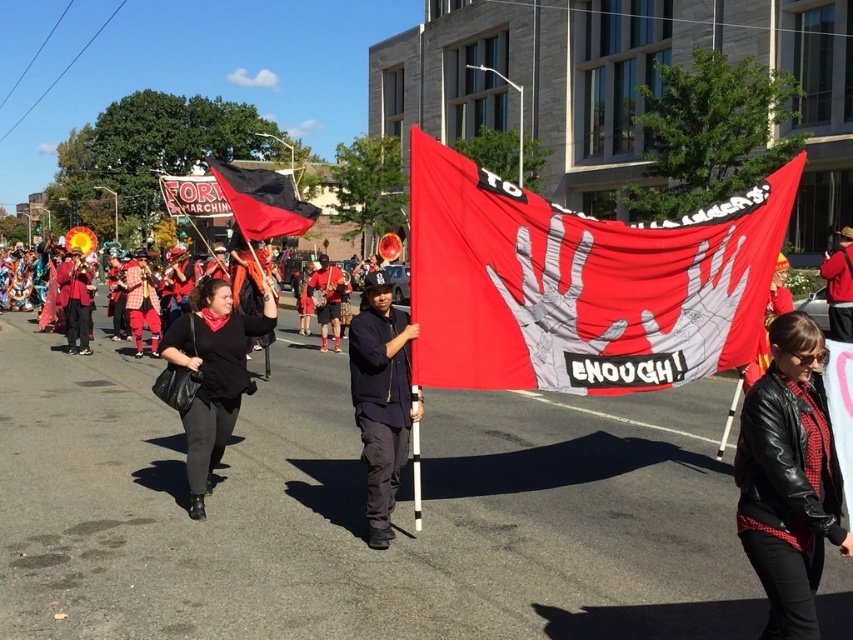
You are a photographer trying to capture the protest scene. You notice the dark blue fabric jacket at center. Based on its position coordinates, where should you aim your camera to include it in the frame?

The dark blue fabric jacket at center is located at coordinates point 0.623 on the x axis and 0.448 on the y axis, so you should aim your camera towards the central area slightly to the right and lower middle to capture it.